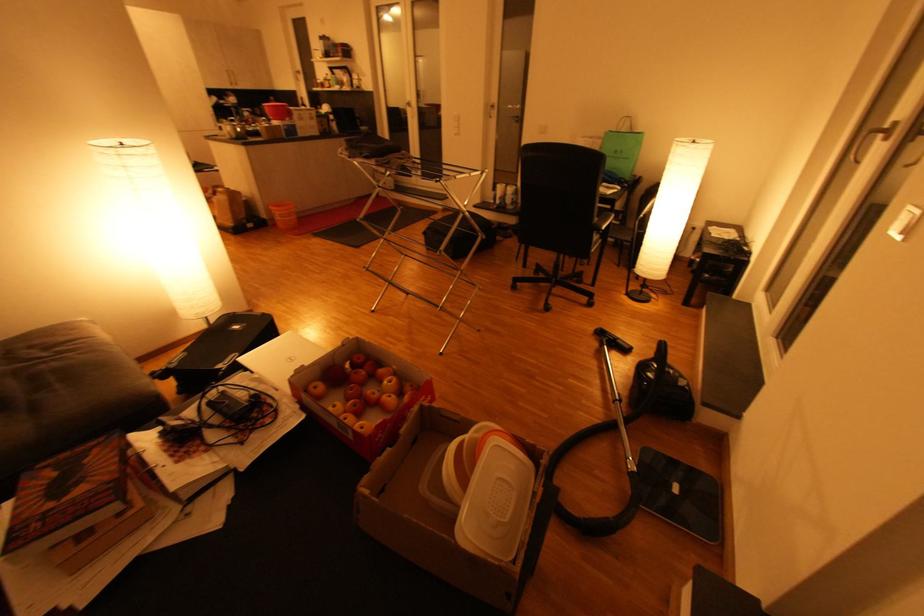
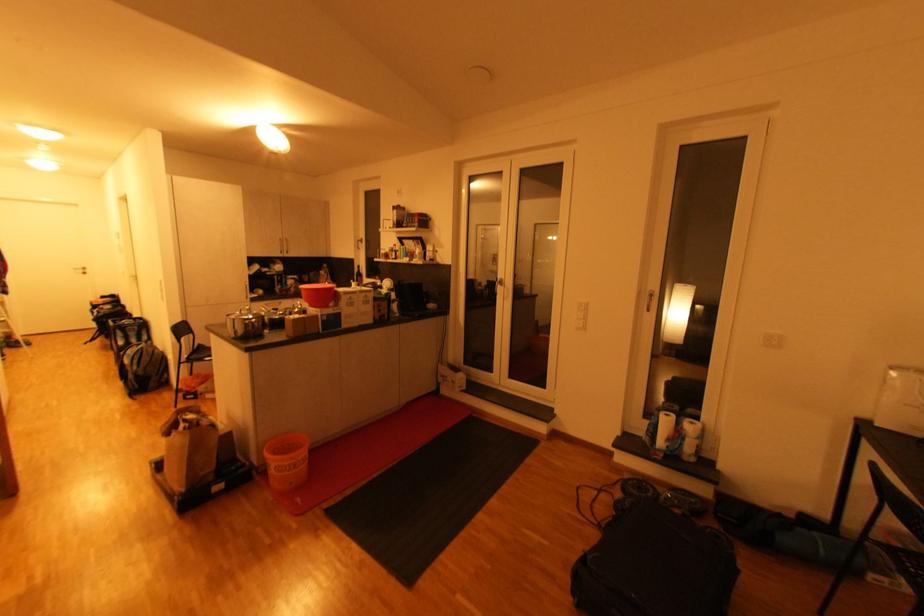
Locate, in the second image, the point that corresponds to (x=503, y=203) in the first image.

(665, 444)